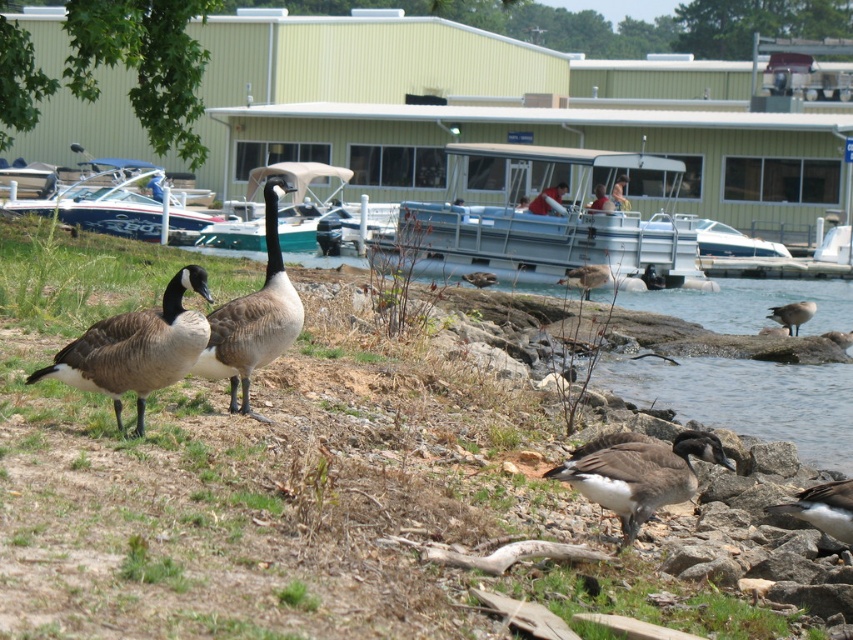
Between point (616, 176) and point (817, 502), which one is positioned behind?

Positioned behind is point (616, 176).

Describe the element at coordinates (543, 220) in the screenshot. I see `metallic blue pontoon boat at center` at that location.

Between point (550, 172) and point (820, 484), which one is positioned in front?

Point (820, 484)

Find the location of a particular element. This screenshot has height=640, width=853. metallic blue pontoon boat at center is located at coordinates [x=543, y=220].

Between brown feathered goose at lower left and blue glossy boat at center, which one has more height?

With more height is blue glossy boat at center.

Which is in front, point (132, 371) or point (108, 170)?

Positioned in front is point (132, 371).

What are the coordinates of `brown feathered goose at lower left` in the screenshot? It's located at (136, 348).

The height and width of the screenshot is (640, 853). What are the coordinates of `brown feathered goose at lower left` in the screenshot? It's located at (136, 348).

Who is shorter, dark brown feathers at lower right or brown feathered duck at lower right?

dark brown feathers at lower right is shorter.

Which is in front, point (817, 486) or point (807, 316)?

Positioned in front is point (817, 486).

Who is more forward, (833, 500) or (769, 308)?

Point (833, 500)

Locate an element on the screen. The width and height of the screenshot is (853, 640). dark brown feathers at lower right is located at coordinates (822, 508).